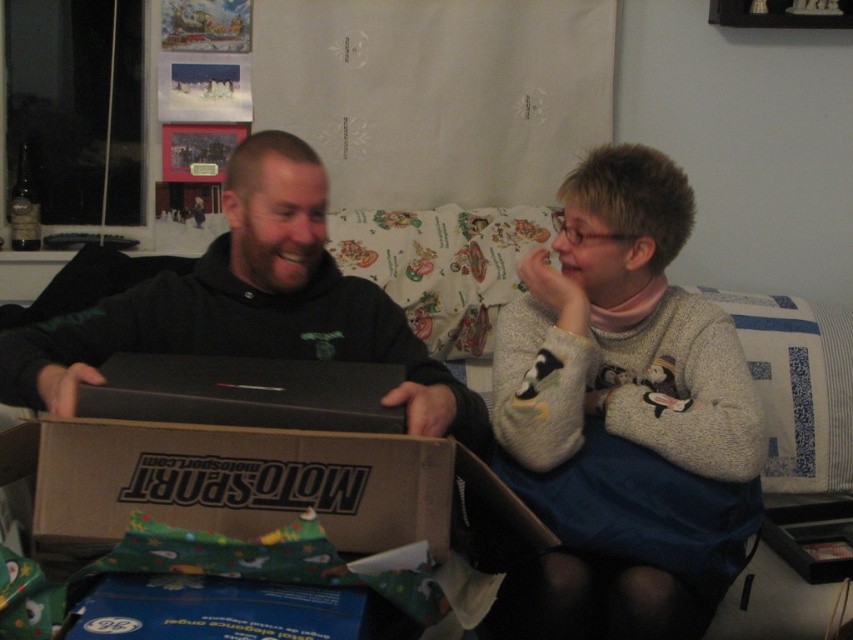
You are trying to place a matte black laptop at center and a black matte laptop at center on a shelf. Which one should you place first to ensure they both fit vertically?

The matte black laptop at center is much taller than the black matte laptop at center, so you should place the taller one first to ensure both fit vertically.

You are a delivery person who just arrived at the house. You need to place a package on the desk where the matte black laptop at center is located. What are the coordinates to place the package so it doesn not block the laptop?

The coordinates to place the package so it doesn not block the matte black laptop at center would be any point not overlapping with its current position at point (625,420).

You are standing in front of the image and want to determine which of the two points, point (537, 428) or point (460, 420), is closer to you. Based on the spatial relationship between them, which one is nearer?

Point (537, 428) is closer to you because it is further to the viewer than point (460, 420).